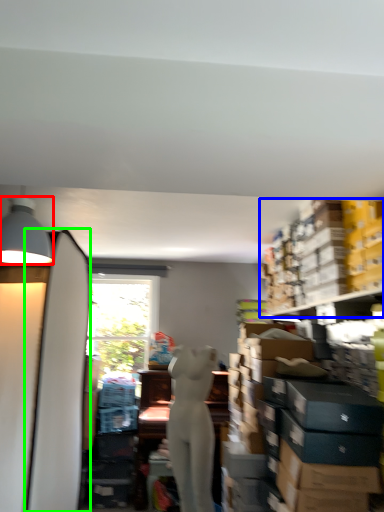
Question: Considering the real-world distances, which object is farthest from lamp (highlighted by a red box)? shelf (highlighted by a blue box) or surfboard (highlighted by a green box)?

Choices:
 (A) shelf
 (B) surfboard

Answer: (A)